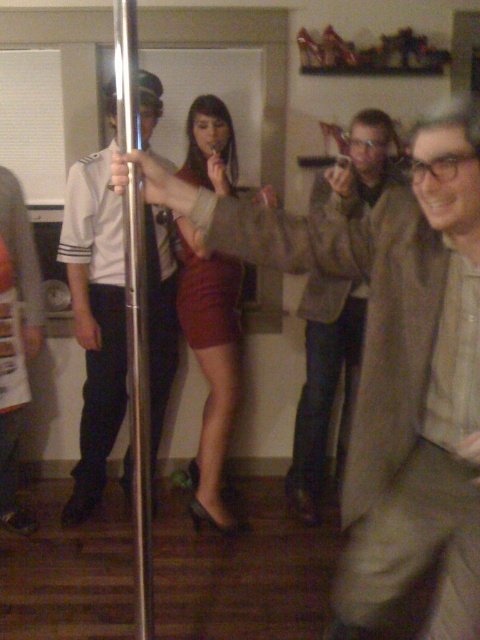
Question: In this image, where is brown suede jacket at center located relative to metallic pole at center?

Choices:
 (A) below
 (B) above

Answer: (A)

Question: Where is matte brown jacket at center located in relation to brown suede jacket at center in the image?

Choices:
 (A) below
 (B) above

Answer: (A)

Question: Among these objects, which one is nearest to the camera?

Choices:
 (A) silver metallic pole at center
 (B) burgundy satin skirt at center
 (C) metallic pole at center

Answer: (C)

Question: Which is farther from the silver metallic pole at center?

Choices:
 (A) khaki cotton shirt at center
 (B) metallic pole at center
 (C) matte brown jacket at center

Answer: (C)

Question: Among these points, which one is farthest from the camera?

Choices:
 (A) coord(166,278)
 (B) coord(453,332)
 (C) coord(188,240)
 (D) coord(41,314)

Answer: (A)

Question: Can you confirm if matte brown jacket at center is wider than brown suede jacket at center?

Choices:
 (A) yes
 (B) no

Answer: (A)